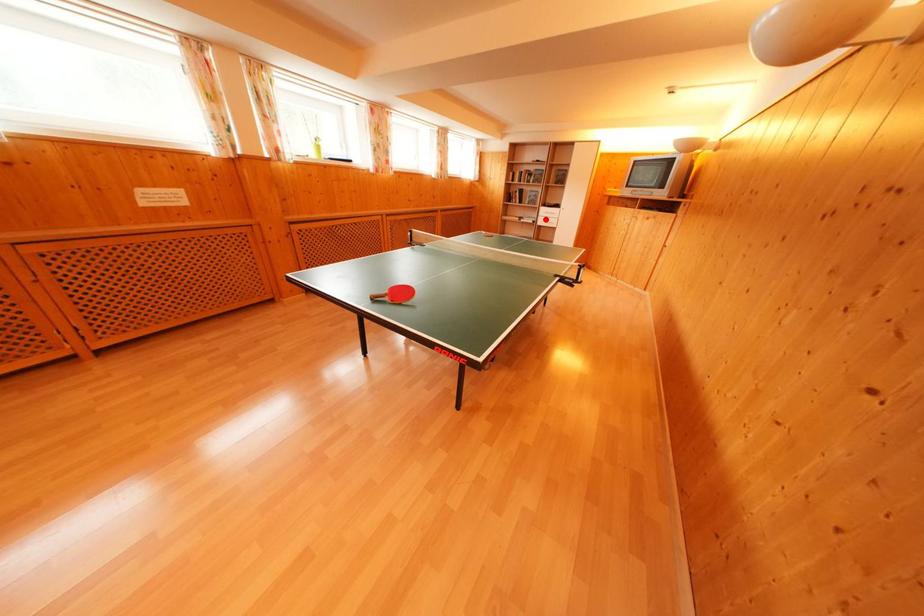
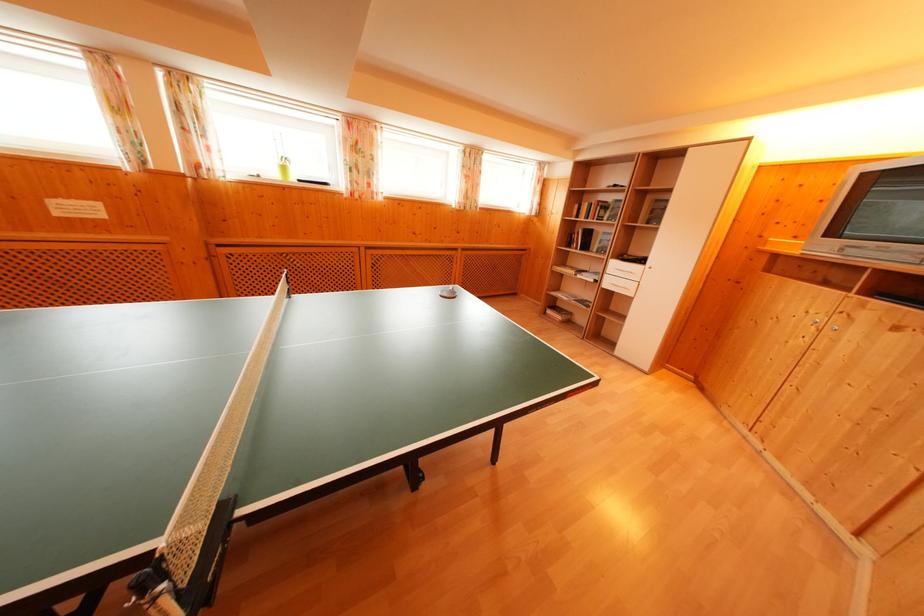
Question: I am providing you with two images of the same scene from different viewpoints. Given a red point in image1, look at the same physical point in image2. Is it:

Choices:
 (A) Closer to the viewpoint
 (B) Farther from the viewpoint

Answer: (B)